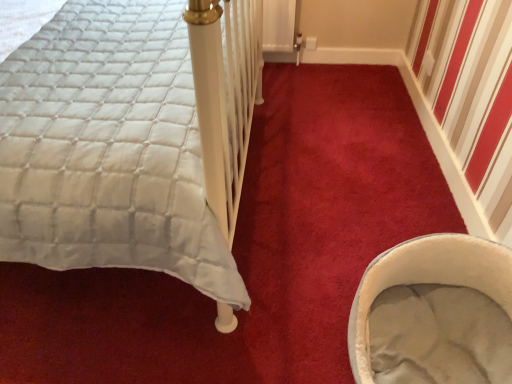
Question: Looking at their shapes, would you say soft gray fabric baby carriage at lower right is wider or thinner than white quilted fabric at left?

Choices:
 (A) wide
 (B) thin

Answer: (B)

Question: Based on their sizes in the image, would you say soft gray fabric baby carriage at lower right is bigger or smaller than white quilted fabric at left?

Choices:
 (A) big
 (B) small

Answer: (B)

Question: Is soft gray fabric baby carriage at lower right in front of or behind white quilted fabric at left in the image?

Choices:
 (A) front
 (B) behind

Answer: (B)

Question: From their relative heights in the image, would you say white quilted fabric at left is taller or shorter than soft gray fabric baby carriage at lower right?

Choices:
 (A) tall
 (B) short

Answer: (A)

Question: Considering their positions, is white quilted fabric at left located in front of or behind soft gray fabric baby carriage at lower right?

Choices:
 (A) front
 (B) behind

Answer: (A)

Question: Considering the positions of white quilted fabric at left and soft gray fabric baby carriage at lower right in the image, is white quilted fabric at left bigger or smaller than soft gray fabric baby carriage at lower right?

Choices:
 (A) big
 (B) small

Answer: (A)

Question: From a real-world perspective, relative to soft gray fabric baby carriage at lower right, is white quilted fabric at left vertically above or below?

Choices:
 (A) above
 (B) below

Answer: (A)